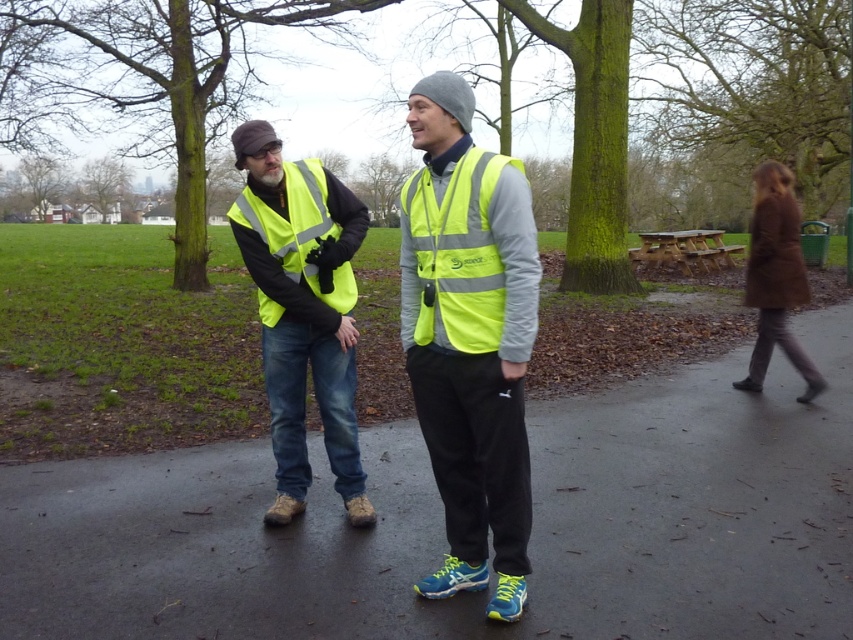
Question: Does neon yellow reflective vest at center appear on the right side of high visibility yellow vest at center?

Choices:
 (A) yes
 (B) no

Answer: (A)

Question: Which of the following is the farthest from the observer?

Choices:
 (A) brown wool coat at right
 (B) high-visibility yellow safety vest at left
 (C) high-visibility fabric safety vest at center
 (D) neon yellow reflective vest at center

Answer: (A)

Question: Does high visibility yellow vest at center lie in front of brown wool coat at right?

Choices:
 (A) no
 (B) yes

Answer: (B)

Question: Estimate the real-world distances between objects in this image. Which object is closer to the high visibility yellow vest at center?

Choices:
 (A) high-visibility yellow safety vest at left
 (B) brown wool coat at right
 (C) neon yellow reflective vest at center
 (D) high-visibility fabric safety vest at center

Answer: (A)

Question: Does neon yellow reflective vest at center appear under brown wool coat at right?

Choices:
 (A) no
 (B) yes

Answer: (B)

Question: Which object is farther from the camera taking this photo?

Choices:
 (A) high visibility yellow vest at center
 (B) neon yellow reflective vest at center

Answer: (A)